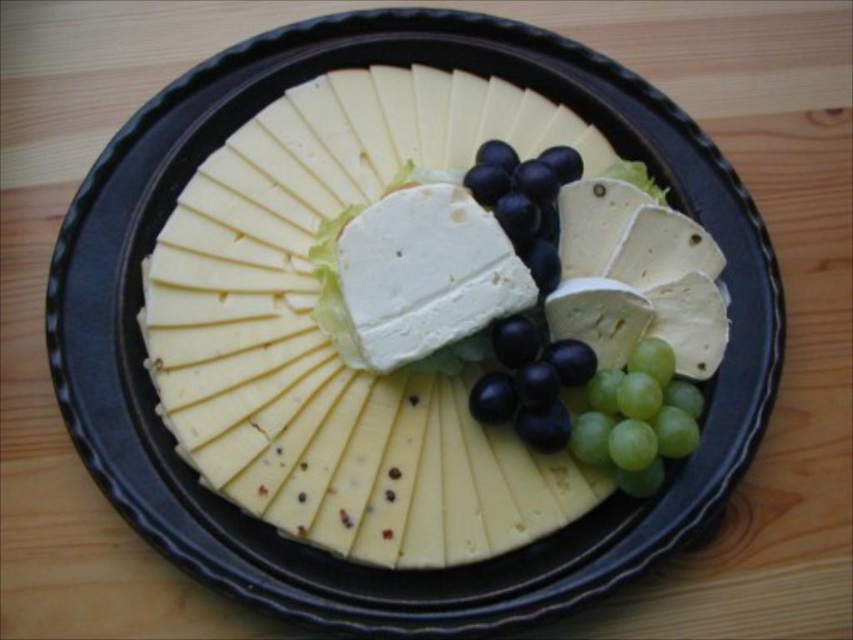
Question: Which point is farther to the camera?

Choices:
 (A) purple glossy grapes at center
 (B) green matte grapes at lower right

Answer: (A)

Question: Which point is farther to the camera?

Choices:
 (A) green matte grapes at lower right
 (B) black glossy grapes at center

Answer: (B)

Question: Is black glossy grapes at center wider than purple glossy grapes at center?

Choices:
 (A) no
 (B) yes

Answer: (B)

Question: Can you confirm if green matte grapes at lower right is thinner than black glossy grapes at center?

Choices:
 (A) yes
 (B) no

Answer: (B)

Question: Which point appears farthest from the camera in this image?

Choices:
 (A) (664, 342)
 (B) (498, 157)
 (C) (498, 410)

Answer: (B)

Question: Does green matte grapes at lower right appear on the left side of black glossy grapes at center?

Choices:
 (A) yes
 (B) no

Answer: (B)